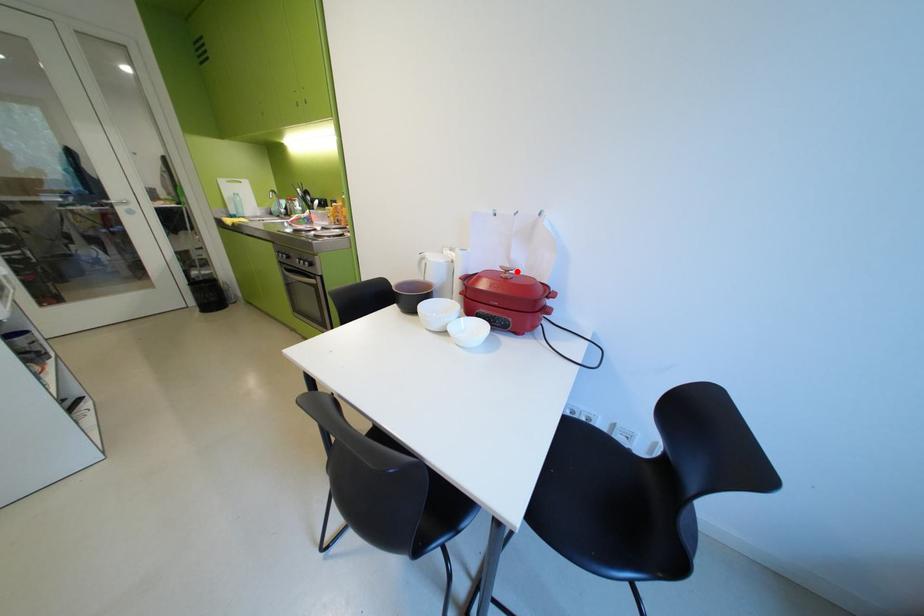
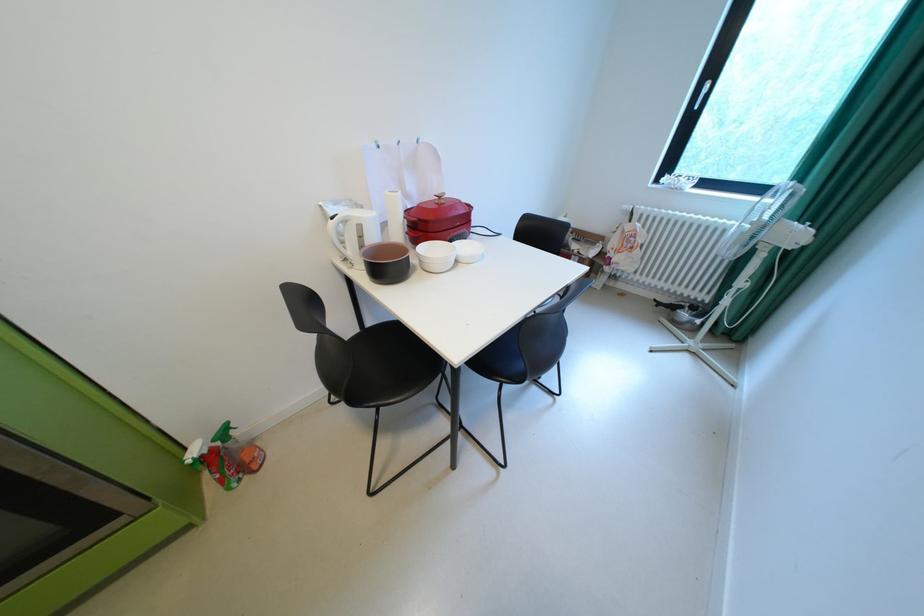
Locate, in the second image, the point that corresponds to the highlighted location in the first image.

(450, 198)